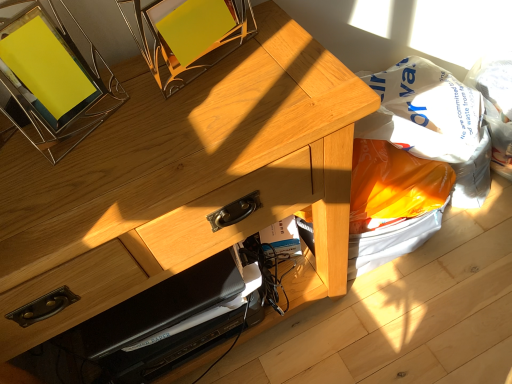
Describe the element at coordinates (393, 203) in the screenshot. I see `orange plastic bag at lower right` at that location.

What do you see at coordinates (52, 83) in the screenshot? I see `metallic yellow picture frame at upper left` at bounding box center [52, 83].

Describe the element at coordinates (183, 181) in the screenshot. The height and width of the screenshot is (384, 512). I see `natural wood desk at center` at that location.

What do you see at coordinates (433, 123) in the screenshot? This screenshot has width=512, height=384. I see `white plastic grocery bag at lower right` at bounding box center [433, 123].

This screenshot has height=384, width=512. Find the location of `orange plastic bag at lower right`. orange plastic bag at lower right is located at coordinates (393, 203).

The height and width of the screenshot is (384, 512). Find the location of `grocery bag on the right side of metallic yellow picture frame at upper left`. grocery bag on the right side of metallic yellow picture frame at upper left is located at coordinates (433, 123).

From the picture: Which object is closer to the camera taking this photo, white plastic grocery bag at lower right or metallic yellow picture frame at upper left?

Positioned in front is metallic yellow picture frame at upper left.

From the image's perspective, is white plastic grocery bag at lower right under metallic yellow picture frame at upper left?

Indeed, from the image's perspective, white plastic grocery bag at lower right is shown beneath metallic yellow picture frame at upper left.

Is metallic yellow picture frame at upper left located within white plastic grocery bag at lower right?

No, metallic yellow picture frame at upper left is located outside of white plastic grocery bag at lower right.

Is point (170, 132) in front of point (44, 136)?

Yes.

From the image's perspective, is natural wood desk at center below metallic yellow picture frame at upper left?

Correct, natural wood desk at center appears lower than metallic yellow picture frame at upper left in the image.

Looking at this image, between natural wood desk at center and metallic yellow picture frame at upper left, which one is positioned behind?

natural wood desk at center is further away from the camera.

At what (x,y) coordinates should I click in order to perform the action: click on garbage above the natural wood desk at center (from the image's perspective). Please return your answer as a coordinate pair (x, y). This screenshot has height=384, width=512. Looking at the image, I should click on (393, 203).

Is point (400, 158) closer to camera compared to point (37, 207)?

That is False.

Considering the relative sizes of orange plastic bag at lower right and natural wood desk at center in the image provided, is orange plastic bag at lower right taller than natural wood desk at center?

In fact, orange plastic bag at lower right may be shorter than natural wood desk at center.

Which object is closer to the camera taking this photo, white plastic grocery bag at lower right or orange plastic bag at lower right?

white plastic grocery bag at lower right is closer to the camera.

From the image's perspective, which object appears higher, white plastic grocery bag at lower right or orange plastic bag at lower right?

white plastic grocery bag at lower right appears higher in the image.

Consider the image. From a real-world perspective, is white plastic grocery bag at lower right on top of orange plastic bag at lower right?

Yes.

Would you say orange plastic bag at lower right is part of white plastic grocery bag at lower right's contents?

No.

Is natural wood desk at center wider or thinner than orange plastic bag at lower right?

Clearly, natural wood desk at center has more width compared to orange plastic bag at lower right.

Is the surface of natural wood desk at center in direct contact with orange plastic bag at lower right?

natural wood desk at center and orange plastic bag at lower right are clearly separated.

Which of these two, natural wood desk at center or orange plastic bag at lower right, stands taller?

With more height is natural wood desk at center.

Would you say natural wood desk at center is inside or outside orange plastic bag at lower right?

The correct answer is: outside.

Based on the photo, between metallic yellow picture frame at upper left and white plastic grocery bag at lower right, which one appears on the left side from the viewer's perspective?

Positioned to the left is metallic yellow picture frame at upper left.

From the picture: Is metallic yellow picture frame at upper left far away from white plastic grocery bag at lower right?

metallic yellow picture frame at upper left is near white plastic grocery bag at lower right, not far away.

Considering the sizes of objects metallic yellow picture frame at upper left and white plastic grocery bag at lower right in the image provided, who is thinner, metallic yellow picture frame at upper left or white plastic grocery bag at lower right?

Thinner between the two is metallic yellow picture frame at upper left.

At what (x,y) coordinates should I click in order to perform the action: click on grocery bag behind the metallic yellow picture frame at upper left. Please return your answer as a coordinate pair (x, y). Looking at the image, I should click on (433, 123).

Looking at this image, is metallic yellow picture frame at upper left inside or outside of orange plastic bag at lower right?

metallic yellow picture frame at upper left is located beyond the bounds of orange plastic bag at lower right.

Considering the positions of objects metallic yellow picture frame at upper left and orange plastic bag at lower right in the image provided, who is more to the right, metallic yellow picture frame at upper left or orange plastic bag at lower right?

orange plastic bag at lower right.

What's the angular difference between metallic yellow picture frame at upper left and orange plastic bag at lower right's facing directions?

21.8 degrees.

Where is `picture frame above the white plastic grocery bag at lower right (from the image's perspective)`? Image resolution: width=512 pixels, height=384 pixels. picture frame above the white plastic grocery bag at lower right (from the image's perspective) is located at coordinates (52, 83).

This screenshot has height=384, width=512. I want to click on desk that appears on the right of metallic yellow picture frame at upper left, so click(183, 181).

When comparing their distances from metallic yellow picture frame at upper left, does orange plastic bag at lower right or white plastic grocery bag at lower right seem further?

The object further to metallic yellow picture frame at upper left is white plastic grocery bag at lower right.

Considering their positions, is natural wood desk at center positioned further to metallic yellow picture frame at upper left than orange plastic bag at lower right?

The object further to metallic yellow picture frame at upper left is orange plastic bag at lower right.

Which object lies further to the anchor point metallic yellow picture frame at upper left, natural wood desk at center or white plastic grocery bag at lower right?

Among the two, white plastic grocery bag at lower right is located further to metallic yellow picture frame at upper left.

Considering their positions, is metallic yellow picture frame at upper left positioned closer to orange plastic bag at lower right than white plastic grocery bag at lower right?

white plastic grocery bag at lower right.

Considering their positions, is natural wood desk at center positioned further to orange plastic bag at lower right than metallic yellow picture frame at upper left?

Among the two, metallic yellow picture frame at upper left is located further to orange plastic bag at lower right.

Estimate the real-world distances between objects in this image. Which object is closer to orange plastic bag at lower right, white plastic grocery bag at lower right or metallic yellow picture frame at upper left?

white plastic grocery bag at lower right.

When comparing their distances from metallic yellow picture frame at upper left, does white plastic grocery bag at lower right or orange plastic bag at lower right seem closer?

orange plastic bag at lower right is closer to metallic yellow picture frame at upper left.

Which object lies further to the anchor point natural wood desk at center, metallic yellow picture frame at upper left or orange plastic bag at lower right?

orange plastic bag at lower right.

Identify the location of garbage between natural wood desk at center and white plastic grocery bag at lower right. (393, 203).

You are a GUI agent. You are given a task and a screenshot of the screen. Output one action in this format:
    pyautogui.click(x=<x>, y=<y>)
    Task: Click on the desk between metallic yellow picture frame at upper left and white plastic grocery bag at lower right in the horizontal direction
    The image size is (512, 384).
    Given the screenshot: What is the action you would take?
    tap(183, 181)

The width and height of the screenshot is (512, 384). I want to click on desk located between metallic yellow picture frame at upper left and orange plastic bag at lower right in the left-right direction, so 183,181.

Where is `garbage between metallic yellow picture frame at upper left and white plastic grocery bag at lower right in the horizontal direction`? garbage between metallic yellow picture frame at upper left and white plastic grocery bag at lower right in the horizontal direction is located at coordinates (393, 203).